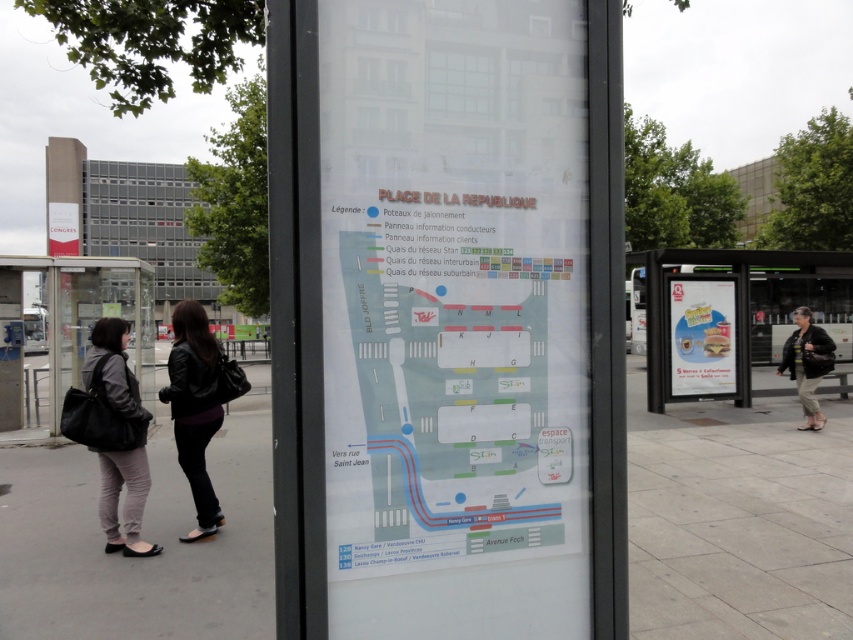
Question: Does transparent plastic map at center have a greater width compared to white plastic bench at right?

Choices:
 (A) yes
 (B) no

Answer: (B)

Question: Which of the following is the closest to the observer?

Choices:
 (A) dark brown leather jacket at lower right
 (B) gray leather jacket at lower left

Answer: (B)

Question: Which object is farther from the camera taking this photo?

Choices:
 (A) transparent plastic bus stop at left
 (B) gray leather jacket at lower left

Answer: (A)

Question: Is black leather jacket at lower left wider than gray leather jacket at lower left?

Choices:
 (A) yes
 (B) no

Answer: (A)

Question: Estimate the real-world distances between objects in this image. Which object is farther from the gray leather jacket at lower left?

Choices:
 (A) white plastic bench at right
 (B) transparent plastic map at center

Answer: (A)

Question: Can you confirm if transparent plastic map at center is positioned above smooth concrete pavement at center?

Choices:
 (A) yes
 (B) no

Answer: (A)